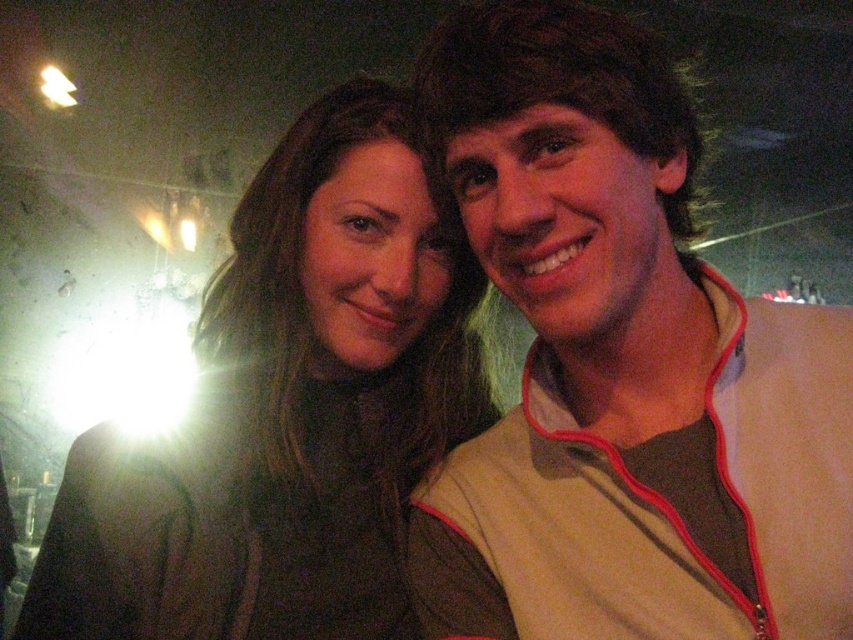
Question: Does tan fabric jacket at upper right lie behind matte black jacket at center?

Choices:
 (A) yes
 (B) no

Answer: (B)

Question: Which point is farther from the camera taking this photo?

Choices:
 (A) (204, 605)
 (B) (634, 538)

Answer: (A)

Question: Which of the following is the closest to the observer?

Choices:
 (A) tan fabric jacket at upper right
 (B) matte black jacket at center

Answer: (A)

Question: Is tan fabric jacket at upper right behind matte black jacket at center?

Choices:
 (A) no
 (B) yes

Answer: (A)

Question: Is tan fabric jacket at upper right further to the viewer compared to matte black jacket at center?

Choices:
 (A) yes
 (B) no

Answer: (B)

Question: Which of the following is the closest to the observer?

Choices:
 (A) matte black jacket at center
 (B) tan fabric jacket at upper right

Answer: (B)